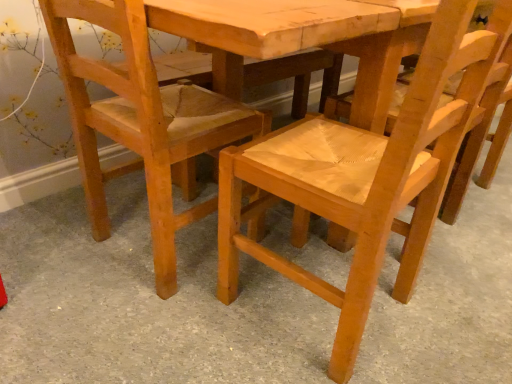
This screenshot has width=512, height=384. Identify the location of free location to the left of light brown wood chair at lower left, the second chair positioned from the right. (47, 243).